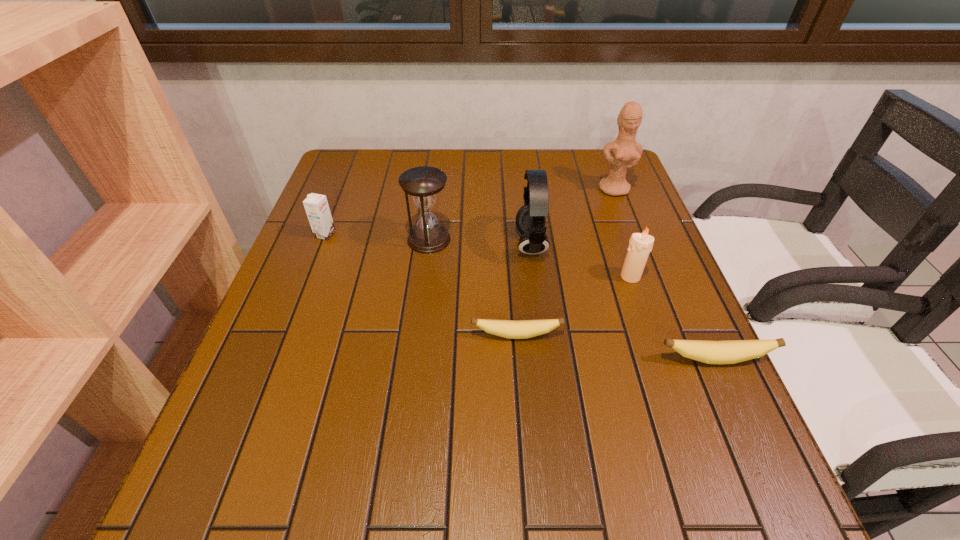
This screenshot has height=540, width=960. In order to click on candle in this screenshot , I will do `click(640, 244)`.

What are the coordinates of `the fourth shortest object` in the screenshot? It's located at (640, 244).

This screenshot has width=960, height=540. I want to click on vacant space positioned on the front of the farther banana, so click(521, 395).

Image resolution: width=960 pixels, height=540 pixels. What are the coordinates of `free location located on the back of the nearer banana` in the screenshot? It's located at (660, 238).

Where is `vacant area situated on the front-facing side of the farthest object`? vacant area situated on the front-facing side of the farthest object is located at coordinates (647, 275).

Locate an element on the screen. The width and height of the screenshot is (960, 540). free region located 0.120m on the ear cups of the earphone is located at coordinates (468, 244).

In order to click on vacant space located 0.240m on the ear cups of the earphone in this screenshot , I will do `click(420, 244)`.

Where is `blank space located on the ear cups of the earphone`? Image resolution: width=960 pixels, height=540 pixels. blank space located on the ear cups of the earphone is located at coordinates [359, 244].

At what (x,y) coordinates should I click in order to perform the action: click on vacant space located on the left of the hourglass. Please return your answer as a coordinate pair (x, y). Image resolution: width=960 pixels, height=540 pixels. Looking at the image, I should click on (379, 239).

At what (x,y) coordinates should I click in order to perform the action: click on free space located 0.230m on the front of the fifth tallest object. Please return your answer as a coordinate pair (x, y). This screenshot has width=960, height=540. Looking at the image, I should click on (297, 310).